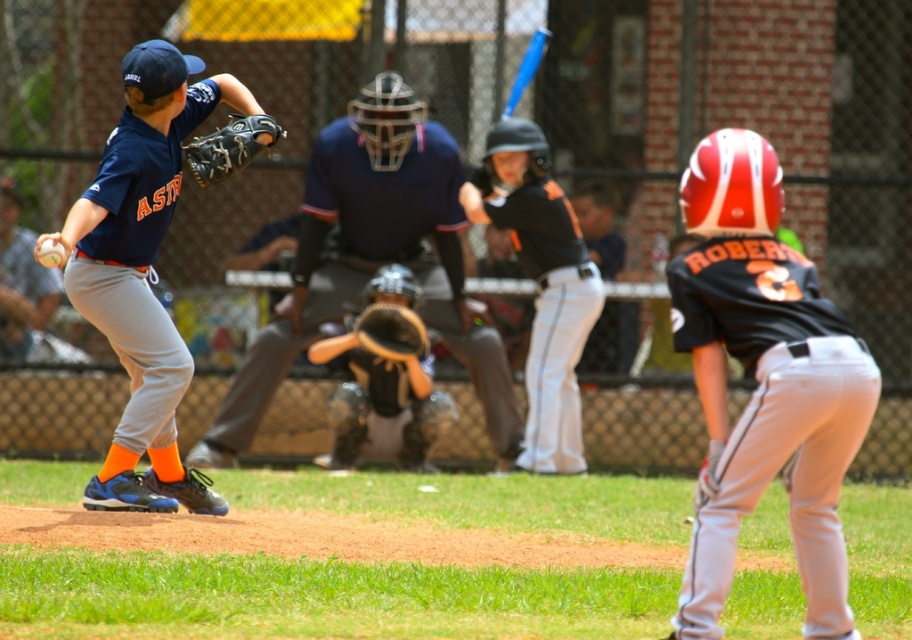
Does matte black helmet at upper right appear under black matte uniform at center?

Indeed, matte black helmet at upper right is positioned under black matte uniform at center.

Is matte black helmet at upper right wider than black matte uniform at center?

In fact, matte black helmet at upper right might be narrower than black matte uniform at center.

Is point (736, 269) farther from viewer compared to point (548, 333)?

No.

I want to click on matte black helmet at upper right, so click(763, 384).

Where is `dark blue jersey at center`? The image size is (912, 640). dark blue jersey at center is located at coordinates (372, 260).

Does point (342, 218) come farther from viewer compared to point (57, 241)?

That is True.

The height and width of the screenshot is (640, 912). Describe the element at coordinates (372, 260) in the screenshot. I see `dark blue jersey at center` at that location.

Locate an element on the screen. dark blue jersey at center is located at coordinates (372, 260).

Identify the location of black matte catcher's mitt at center. (382, 404).

Who is more distant from viewer, (322, 360) or (506, 113)?

The point (506, 113) is more distant.

Is point (379, 276) farther from viewer compared to point (534, 33)?

No.

Identify the location of black matte catcher's mitt at center. This screenshot has height=640, width=912. (382, 404).